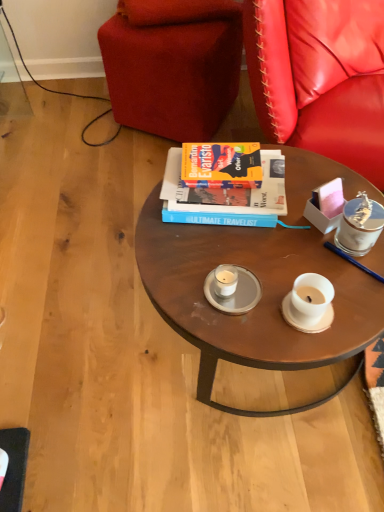
This screenshot has height=512, width=384. Identify the location of vacant space in front of white matte candle at center, marked as the 1th coffee cup in a left-to-right arrangement. (242, 329).